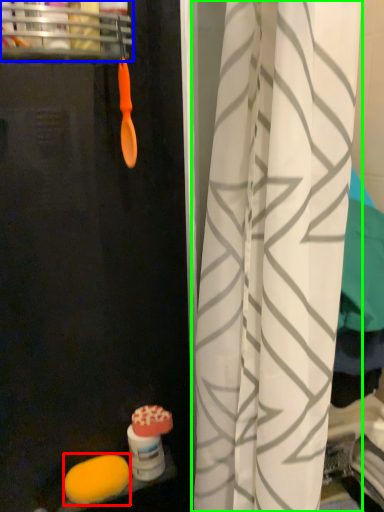
Question: Based on their relative distances, which object is farther from food (highlighted by a red box)? Choose from shelf (highlighted by a blue box) and curtain (highlighted by a green box).

Choices:
 (A) shelf
 (B) curtain

Answer: (A)